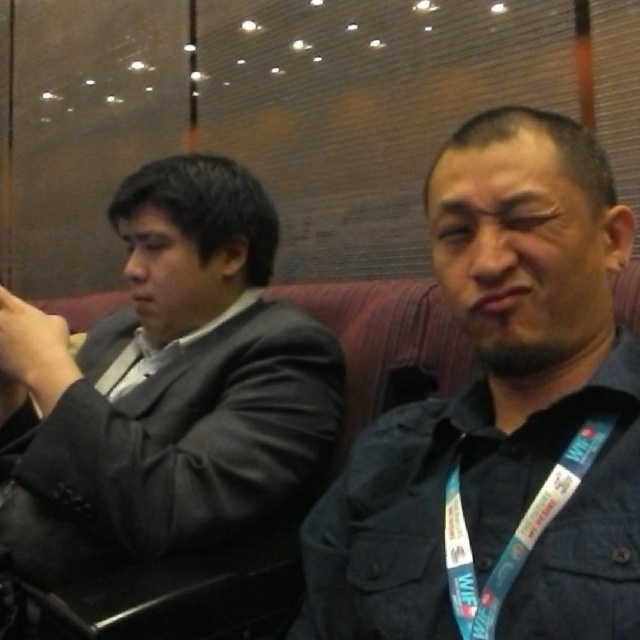
Does dark blue denim jacket at center appear over matte black suit at left?

No.

Which of these two, dark blue denim jacket at center or matte black suit at left, stands shorter?

Standing shorter between the two is dark blue denim jacket at center.

Image resolution: width=640 pixels, height=640 pixels. What do you see at coordinates (500, 419) in the screenshot?
I see `dark blue denim jacket at center` at bounding box center [500, 419].

Identify the location of dark blue denim jacket at center. (500, 419).

Can you confirm if dark blue denim jacket at center is positioned to the right of blue fabric lanyard at right?

In fact, dark blue denim jacket at center is to the left of blue fabric lanyard at right.

The image size is (640, 640). I want to click on dark blue denim jacket at center, so click(500, 419).

At what (x,y) coordinates should I click in order to perform the action: click on dark blue denim jacket at center. Please return your answer as a coordinate pair (x, y). This screenshot has height=640, width=640. Looking at the image, I should click on (500, 419).

You are a GUI agent. You are given a task and a screenshot of the screen. Output one action in this format:
    pyautogui.click(x=<x>, y=<y>)
    Task: Click on the dark blue denim jacket at center
    The width and height of the screenshot is (640, 640).
    Given the screenshot: What is the action you would take?
    pyautogui.click(x=500, y=419)

Who is positioned more to the left, matte black suit at left or blue fabric lanyard at right?

matte black suit at left

Is matte black suit at left positioned in front of blue fabric lanyard at right?

No, it is not.

Is point (161, 260) more distant than point (560, 493)?

Yes, it is behind point (560, 493).

This screenshot has width=640, height=640. What are the coordinates of `matte black suit at left` in the screenshot? It's located at (164, 387).